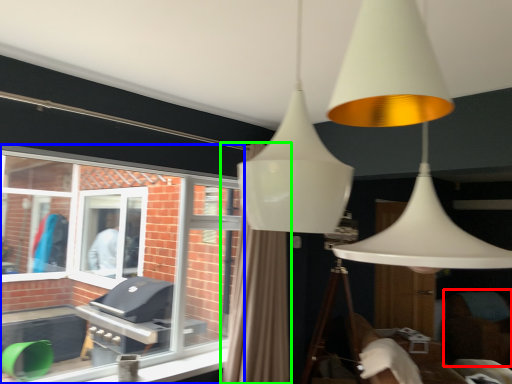
Question: Considering the real-world distances, which object is farthest from swivel chair (highlighted by a red box)? window (highlighted by a blue box) or curtain (highlighted by a green box)?

Choices:
 (A) window
 (B) curtain

Answer: (A)